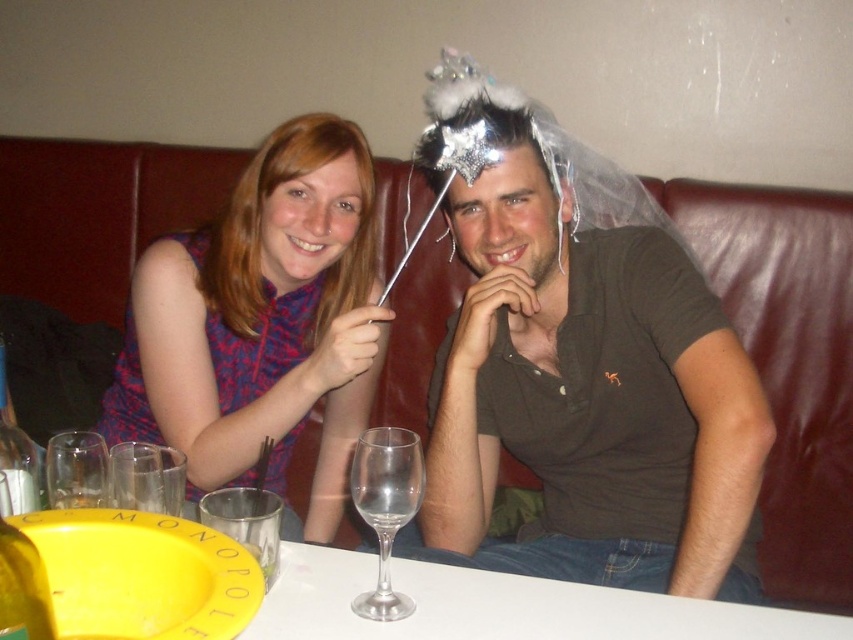
Question: Which object is the closest to the shiny silver headdress at upper center?

Choices:
 (A) clear glass wine glass at lower left
 (B) matte purple dress at center
 (C) transparent glass wine glass at center

Answer: (B)

Question: Does matte brown shirt at center appear over transparent glass wine glass at center?

Choices:
 (A) yes
 (B) no

Answer: (A)

Question: Among these points, which one is nearest to the camera?

Choices:
 (A) click(280, 328)
 (B) click(416, 492)
 (C) click(73, 461)
 (D) click(457, 460)

Answer: (B)

Question: Which point is farther from the camera taking this photo?

Choices:
 (A) 532,173
 (B) 444,54

Answer: (B)

Question: Can you confirm if matte brown shirt at center is bigger than matte purple dress at center?

Choices:
 (A) no
 (B) yes

Answer: (B)

Question: In this image, where is matte purple dress at center located relative to transparent glass wine glass at center?

Choices:
 (A) below
 (B) above

Answer: (B)